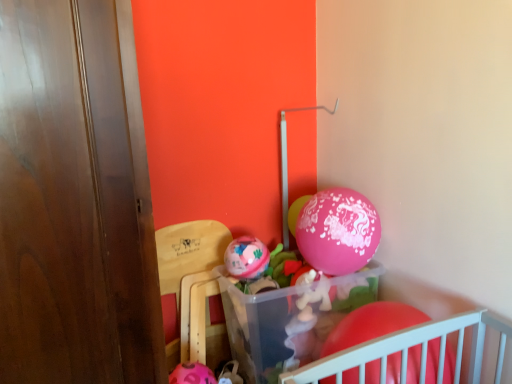
Question: Is rubber matte balloon at lower right, which is the 1th balloon from right to left, facing away from wooden chair at lower left?

Choices:
 (A) yes
 (B) no

Answer: (B)

Question: Is the surface of rubber matte balloon at lower right, the 3th balloon when ordered from back to front, in direct contact with wooden chair at lower left?

Choices:
 (A) yes
 (B) no

Answer: (B)

Question: Is the position of rubber matte balloon at lower right, marked as the 1th balloon in a bottom-to-top arrangement, less distant than that of wooden chair at lower left?

Choices:
 (A) no
 (B) yes

Answer: (B)

Question: From the image's perspective, is rubber matte balloon at lower right, which is the first balloon from front to back, over wooden chair at lower left?

Choices:
 (A) yes
 (B) no

Answer: (B)

Question: Could you tell me if rubber matte balloon at lower right, the 3th balloon when ordered from back to front, is turned towards wooden chair at lower left?

Choices:
 (A) no
 (B) yes

Answer: (A)

Question: From their relative heights in the image, would you say rubber matte balloon at lower right, marked as the 1th balloon in a bottom-to-top arrangement, is taller or shorter than wooden chair at lower left?

Choices:
 (A) tall
 (B) short

Answer: (B)

Question: From the image's perspective, is rubber matte balloon at lower right, the 3th balloon when ordered from back to front, positioned above or below wooden chair at lower left?

Choices:
 (A) below
 (B) above

Answer: (A)

Question: Is point (391, 369) positioned closer to the camera than point (215, 311)?

Choices:
 (A) closer
 (B) farther

Answer: (A)

Question: From a real-world perspective, relative to wooden chair at lower left, is rubber matte balloon at lower right, the 3th balloon when ordered from back to front, vertically above or below?

Choices:
 (A) above
 (B) below

Answer: (A)

Question: From the image's perspective, is rubber matte balloon at lower right, the 3th balloon when ordered from back to front, located above or below pink glossy balloon at center, the 1th balloon positioned from the back?

Choices:
 (A) below
 (B) above

Answer: (A)

Question: Visually, is rubber matte balloon at lower right, the third balloon viewed from the top, positioned to the left or to the right of pink glossy balloon at center, the 2th balloon viewed from the right?

Choices:
 (A) right
 (B) left

Answer: (A)

Question: From their relative heights in the image, would you say rubber matte balloon at lower right, the 3th balloon when ordered from back to front, is taller or shorter than pink glossy balloon at center, which ranks as the second balloon in left-to-right order?

Choices:
 (A) tall
 (B) short

Answer: (A)

Question: From a real-world perspective, is rubber matte balloon at lower right, marked as the 1th balloon in a bottom-to-top arrangement, positioned above or below pink glossy balloon at center, which ranks as the second balloon in left-to-right order?

Choices:
 (A) above
 (B) below

Answer: (B)

Question: Is wooden chair at lower left taller or shorter than pink glossy balloon at center, the 1th balloon positioned from the top?

Choices:
 (A) tall
 (B) short

Answer: (A)

Question: Is wooden chair at lower left inside or outside of pink glossy balloon at center, acting as the 3th balloon starting from the bottom?

Choices:
 (A) outside
 (B) inside

Answer: (A)